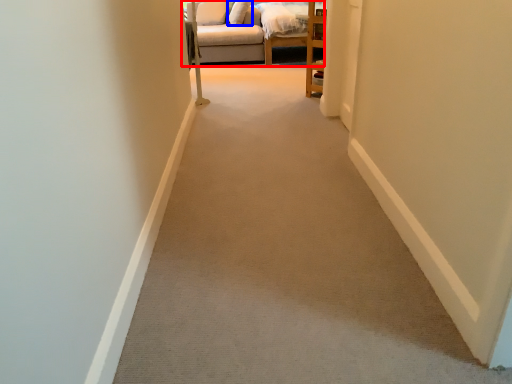
Question: Which object appears closest to the camera in this image, studio couch (highlighted by a red box) or pillow (highlighted by a blue box)?

Choices:
 (A) studio couch
 (B) pillow

Answer: (A)